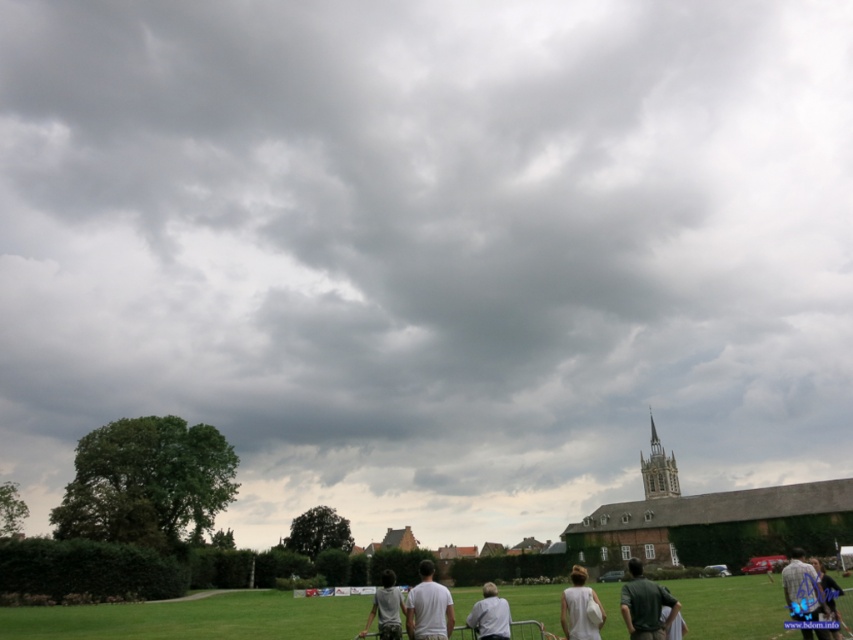
Which of these two, light gray cotton shirt at center or light gray fabric shirt at center, stands shorter?

light gray fabric shirt at center is shorter.

Does light gray cotton shirt at center appear on the left side of light gray fabric shirt at center?

Correct, you'll find light gray cotton shirt at center to the left of light gray fabric shirt at center.

Measure the distance between light gray cotton shirt at center and camera.

171.39 feet

Where is `light gray cotton shirt at center`? light gray cotton shirt at center is located at coordinates (386, 609).

Can you confirm if white matte shirt at center is positioned to the left of blue denim jeans at lower right?

Yes, white matte shirt at center is to the left of blue denim jeans at lower right.

Which is behind, point (445, 604) or point (801, 582)?

Point (445, 604)

Identify the location of white matte shirt at center. The image size is (853, 640). (428, 608).

Is point (641, 624) closer to viewer compared to point (816, 593)?

Yes, point (641, 624) is closer to viewer.

Can you confirm if green fabric shirt at lower right is positioned below blue denim jeans at lower right?

Yes, green fabric shirt at lower right is below blue denim jeans at lower right.

Is point (671, 614) farther from camera compared to point (805, 572)?

No, it is in front of (805, 572).

Identify the location of green fabric shirt at lower right. The width and height of the screenshot is (853, 640). (643, 604).